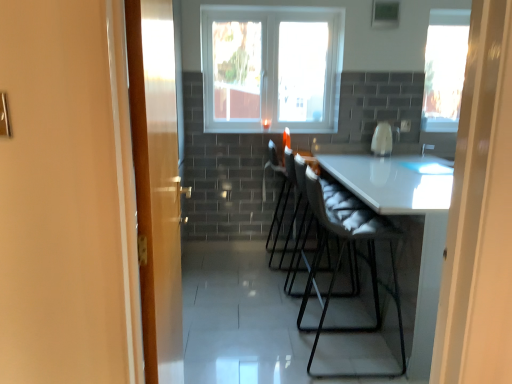
Question: From a real-world perspective, is transparent glass window at upper right, the first window from the right, over white glossy coffee machine at center?

Choices:
 (A) yes
 (B) no

Answer: (A)

Question: Considering the relative sizes of transparent glass window at upper right, the first window from the right, and white glossy coffee machine at center in the image provided, is transparent glass window at upper right, the first window from the right, wider than white glossy coffee machine at center?

Choices:
 (A) yes
 (B) no

Answer: (B)

Question: From the image's perspective, does transparent glass window at upper right, the second window when ordered from left to right, appear lower than white glossy coffee machine at center?

Choices:
 (A) no
 (B) yes

Answer: (A)

Question: Is transparent glass window at upper right, the second window when ordered from left to right, aimed at white glossy coffee machine at center?

Choices:
 (A) no
 (B) yes

Answer: (A)

Question: Is transparent glass window at upper right, the first window from the right, oriented away from white glossy coffee machine at center?

Choices:
 (A) no
 (B) yes

Answer: (A)

Question: From the image's perspective, is transparent glass window at upper right, the second window when ordered from left to right, above white glossy coffee machine at center?

Choices:
 (A) yes
 (B) no

Answer: (A)

Question: Considering the relative sizes of wooden door at left and white fabric folding chair at center in the image provided, is wooden door at left shorter than white fabric folding chair at center?

Choices:
 (A) yes
 (B) no

Answer: (B)

Question: Does wooden door at left have a greater height compared to white fabric folding chair at center?

Choices:
 (A) yes
 (B) no

Answer: (A)

Question: From the image's perspective, does wooden door at left appear higher than white fabric folding chair at center?

Choices:
 (A) yes
 (B) no

Answer: (A)

Question: Considering the relative sizes of wooden door at left and white fabric folding chair at center in the image provided, is wooden door at left bigger than white fabric folding chair at center?

Choices:
 (A) yes
 (B) no

Answer: (B)

Question: Does wooden door at left appear on the left side of white fabric folding chair at center?

Choices:
 (A) yes
 (B) no

Answer: (A)

Question: From the image's perspective, would you say wooden door at left is shown under white fabric folding chair at center?

Choices:
 (A) yes
 (B) no

Answer: (B)

Question: Does transparent glass window at center, marked as the first window in a left-to-right arrangement, have a lesser height compared to white fabric folding chair at center?

Choices:
 (A) no
 (B) yes

Answer: (B)